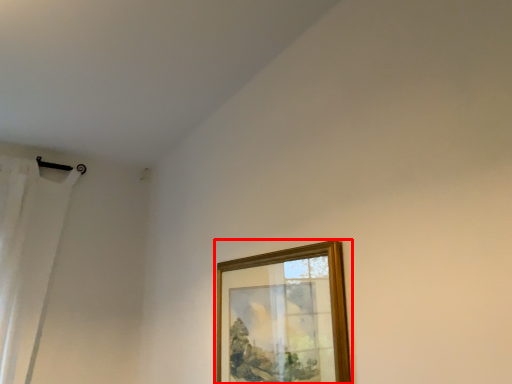
Question: From the image's perspective, what is the correct spatial positioning of picture frame (annotated by the red box) in reference to curtain?

Choices:
 (A) below
 (B) above

Answer: (A)